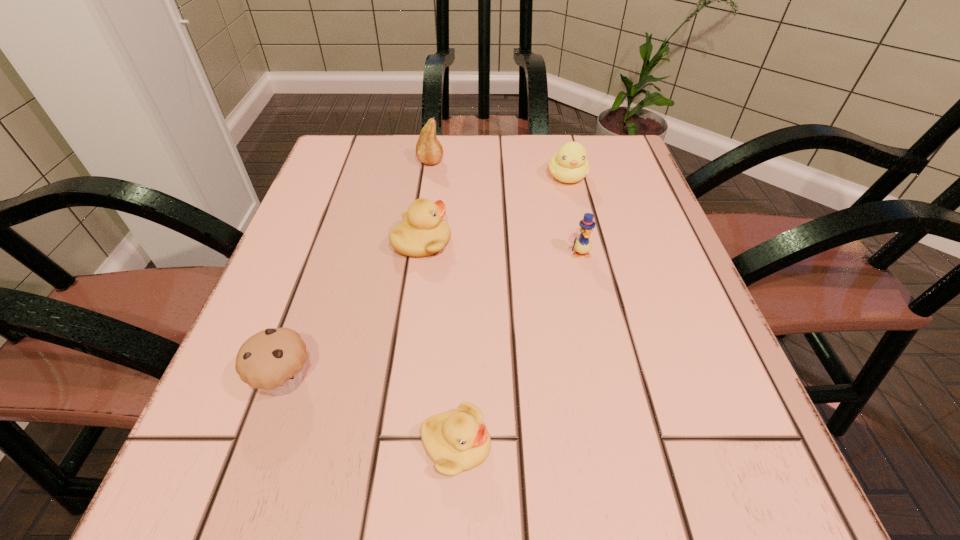
Where is `pear present at the far edge`? The height and width of the screenshot is (540, 960). pear present at the far edge is located at coordinates (429, 150).

The height and width of the screenshot is (540, 960). I want to click on duckling that is at the far edge, so click(570, 164).

Where is `object located at the near edge`? This screenshot has width=960, height=540. object located at the near edge is located at coordinates (457, 440).

Where is `object at the left edge`? This screenshot has height=540, width=960. object at the left edge is located at coordinates (273, 360).

The image size is (960, 540). I want to click on object that is positioned at the far right corner, so click(x=570, y=164).

The width and height of the screenshot is (960, 540). In the image, there is a desktop. In order to click on vacant space at the far edge in this screenshot , I will do `click(515, 139)`.

Identify the location of free space at the near edge of the desktop. (x=328, y=517).

Image resolution: width=960 pixels, height=540 pixels. Identify the location of free space at the left edge. (287, 403).

The width and height of the screenshot is (960, 540). Identify the location of free point at the right edge. (658, 317).

This screenshot has height=540, width=960. Identify the location of vacant space at the far left corner of the desktop. (391, 146).